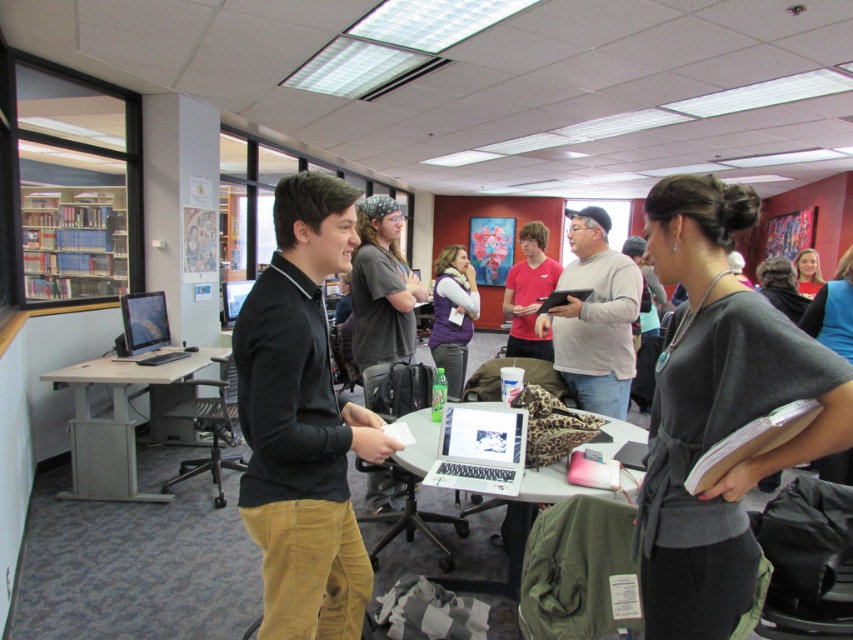
Question: Among these objects, which one is nearest to the camera?

Choices:
 (A) wooden bookshelf at left
 (B) white glossy laptop at center
 (C) matte black laptop at left
 (D) matte purple vest at center

Answer: (B)

Question: Does black corduroy pants at center come behind matte purple vest at center?

Choices:
 (A) yes
 (B) no

Answer: (B)

Question: Among these objects, which one is nearest to the camera?

Choices:
 (A) black corduroy pants at center
 (B) matte purple vest at center

Answer: (A)

Question: Can you confirm if wooden bookshelf at left is thinner than light brown wooden desk at left?

Choices:
 (A) no
 (B) yes

Answer: (A)

Question: Does white glossy laptop at center have a lesser width compared to silver metallic laptop at center?

Choices:
 (A) yes
 (B) no

Answer: (B)

Question: Which of the following is the farthest from the observer?

Choices:
 (A) gray cotton shirt at center
 (B) silver metallic laptop at center

Answer: (A)